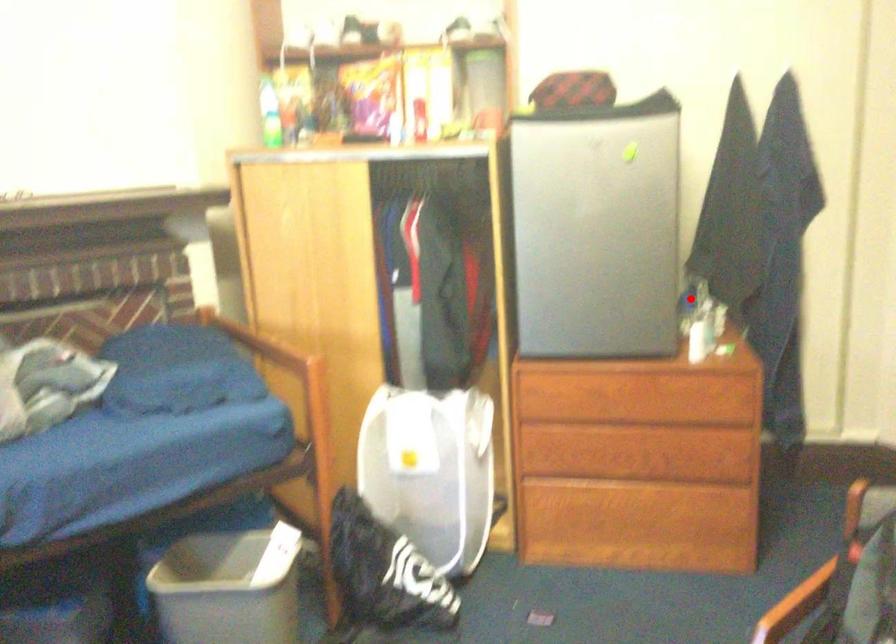
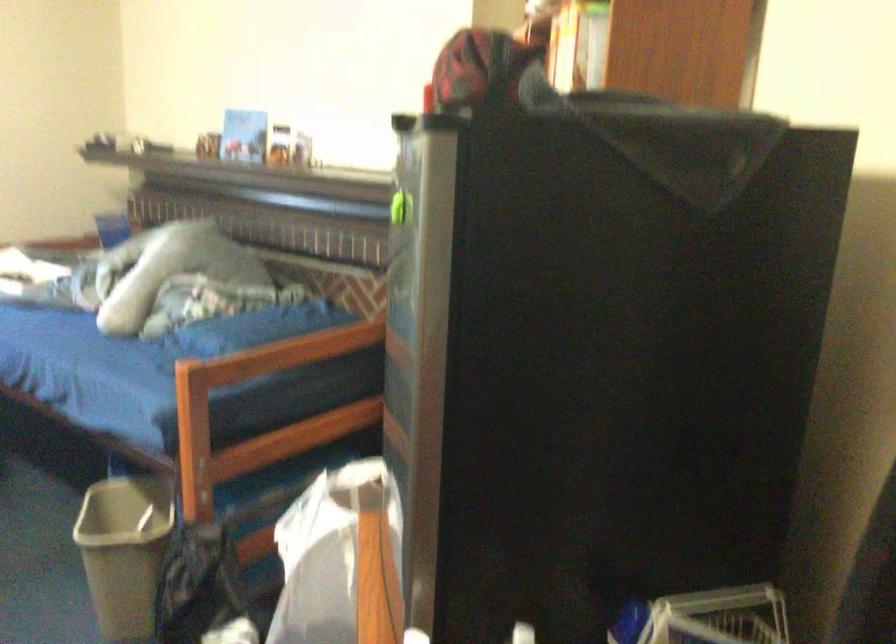
Where in the second image is the point corresponding to the highlighted location from the first image?

(719, 617)